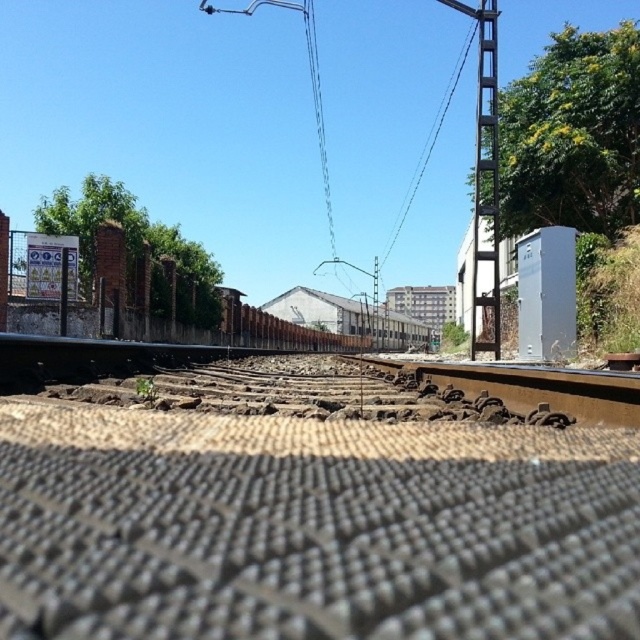
You are a maintenance worker checking the railway. You need to place a 1.2 meter wide equipment between the gray textured gravel at center and the metallic gray train track at center. Is there enough space?

The gray textured gravel at center might be wider than metallic gray train track at center, but without exact measurements, it is uncertain if the 1.2 meter wide equipment can fit between them. Further measurement is required.

You are standing at the pedestrian crossing near the railway tracks and want to reach the point marked as point (86, 352). Considering your height is 5.5 feet, will you be able to see over the brick wall on the left side from that point?

The point (86, 352) is 23.22 feet away from the viewer. Since the brick wall is on the left side of the image and the pedestrian crossing is in the foreground, the distance might allow you to see over the wall if it isn not too tall. However, without knowing the wall height, we can only confirm the distance.

You are a photographer standing at the railway scene. You want to capture a closeup shot of the gray textured gravel at center. What is the minimum distance you need to move forward to focus on the gravel?

The gray textured gravel at center is 16.11 inches away from the camera, so you need to move forward until you are within 16.11 inches to focus on it.